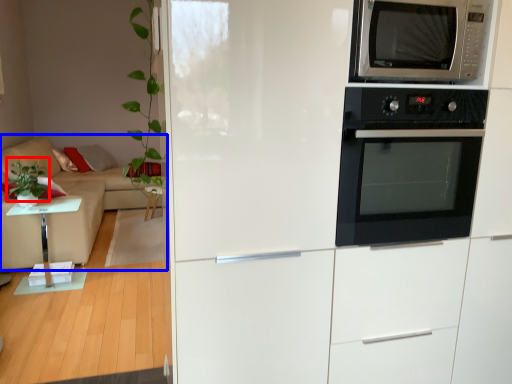
Question: Which of the following is the closest to the observer, plant (highlighted by a red box) or studio couch (highlighted by a blue box)?

Choices:
 (A) plant
 (B) studio couch

Answer: (A)